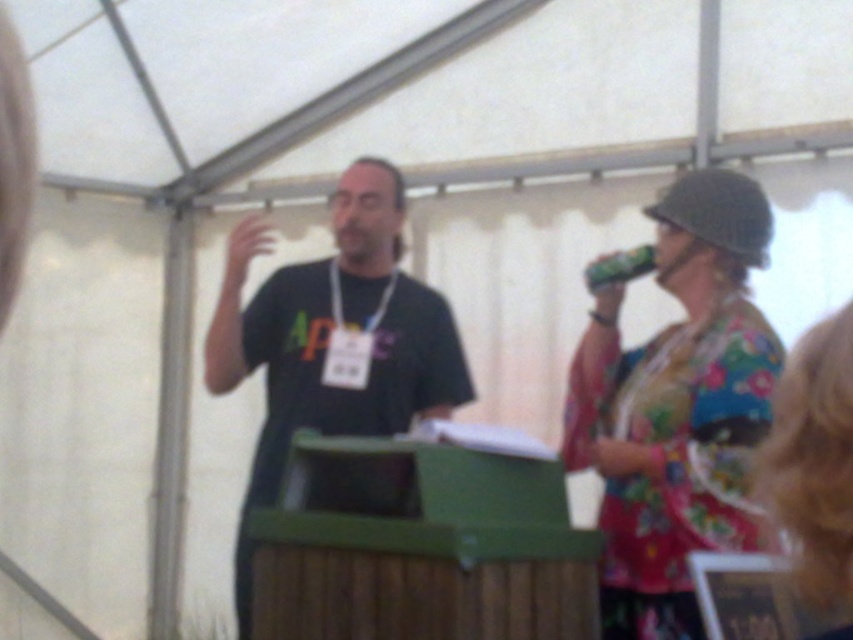
Which is more to the left, floral fabric shirt at upper right or black matte t-shirt at center?

black matte t-shirt at center is more to the left.

Can you confirm if floral fabric shirt at upper right is wider than black matte t-shirt at center?

Incorrect, floral fabric shirt at upper right's width does not surpass black matte t-shirt at center's.

Between point (706, 548) and point (357, 364), which one is positioned in front?

Positioned in front is point (706, 548).

Image resolution: width=853 pixels, height=640 pixels. In order to click on floral fabric shirt at upper right in this screenshot , I will do `click(677, 406)`.

Can you confirm if floral fabric dress at lower right is taller than green matte can at upper right?

Correct, floral fabric dress at lower right is much taller as green matte can at upper right.

Based on the photo, between floral fabric dress at lower right and green matte can at upper right, which one appears on the left side from the viewer's perspective?

Positioned to the left is floral fabric dress at lower right.

Does point (766, 448) come in front of point (618, 260)?

Yes, it is in front of point (618, 260).

Find the location of a particular element. Image resolution: width=853 pixels, height=640 pixels. floral fabric dress at lower right is located at coordinates (814, 465).

Does floral fabric shirt at upper right appear on the right side of floral fabric dress at lower right?

Indeed, floral fabric shirt at upper right is positioned on the right side of floral fabric dress at lower right.

Who is shorter, floral fabric shirt at upper right or floral fabric dress at lower right?

With less height is floral fabric dress at lower right.

This screenshot has width=853, height=640. Describe the element at coordinates (677, 406) in the screenshot. I see `floral fabric shirt at upper right` at that location.

Where is `floral fabric shirt at upper right`? floral fabric shirt at upper right is located at coordinates (677, 406).